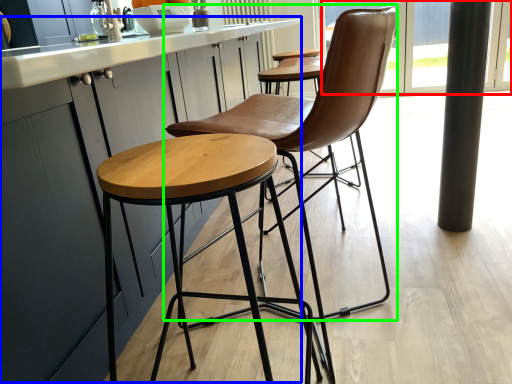
Question: Which is nearer to the window screen (highlighted by a red box)? counter top (highlighted by a blue box) or chair (highlighted by a green box).

Choices:
 (A) counter top
 (B) chair

Answer: (A)